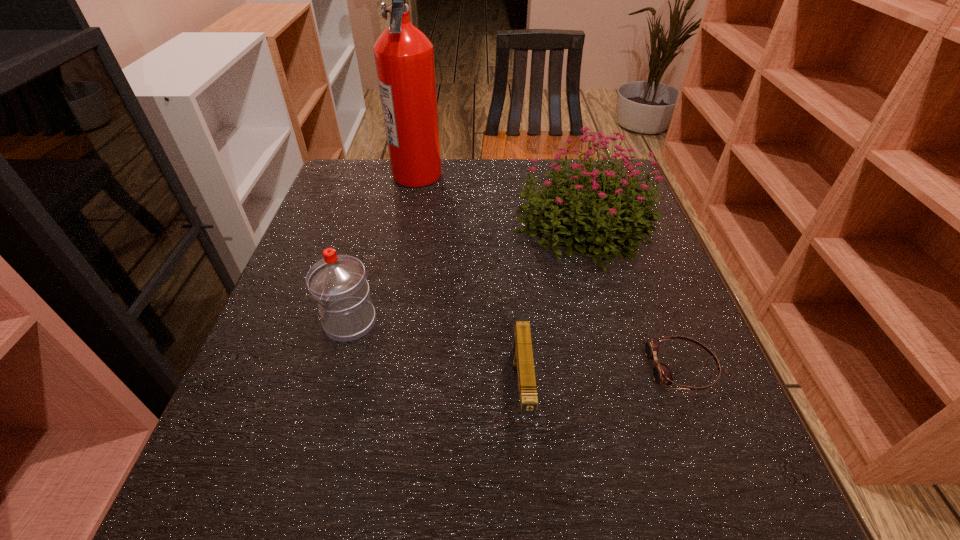
The image size is (960, 540). Identify the location of vacant space at the left edge of the desktop. click(x=324, y=377).

I want to click on vacant area at the right edge, so click(x=737, y=462).

In the image, there is a desktop. Identify the location of blank space at the far left corner. This screenshot has width=960, height=540. (359, 202).

At what (x,y) coordinates should I click in order to perform the action: click on free space at the near left corner. Please return your answer as a coordinate pair (x, y). Looking at the image, I should click on (256, 469).

At what (x,y) coordinates should I click in order to perform the action: click on free space at the near right corner of the desktop. Please return your answer as a coordinate pair (x, y). Looking at the image, I should click on (726, 509).

The image size is (960, 540). I want to click on vacant region between the bouquet and the pistol, so click(x=551, y=310).

Identify the location of free space that is in between the tallest object and the third shortest object. (384, 248).

Find the location of a particular element. Image resolution: width=960 pixels, height=540 pixels. vacant area that lies between the fire extinguisher and the bouquet is located at coordinates (499, 201).

At what (x,y) coordinates should I click in order to perform the action: click on vacant area that lies between the fourth shortest object and the fire extinguisher. Please return your answer as a coordinate pair (x, y). This screenshot has width=960, height=540. Looking at the image, I should click on (499, 201).

Image resolution: width=960 pixels, height=540 pixels. I want to click on unoccupied position between the second shortest object and the water bottle, so click(436, 357).